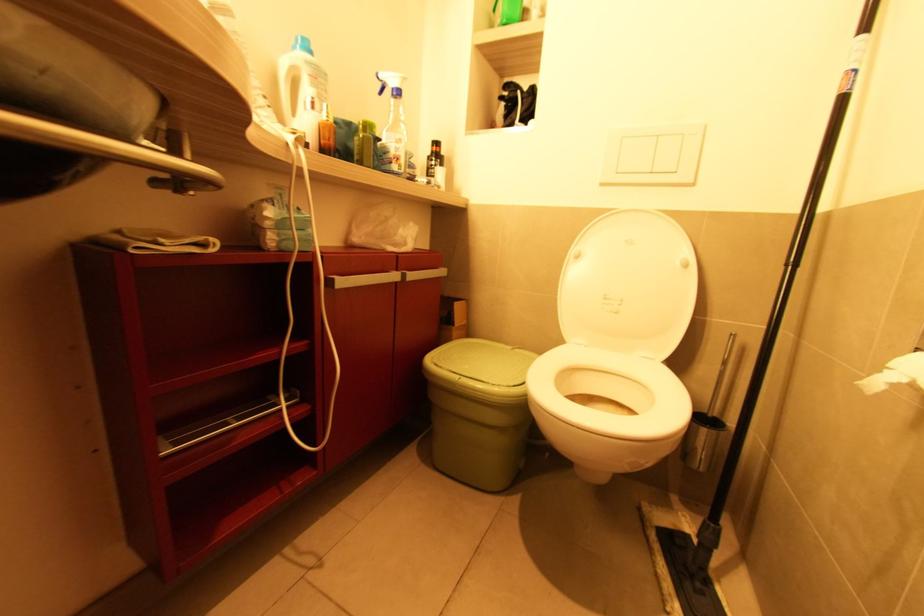
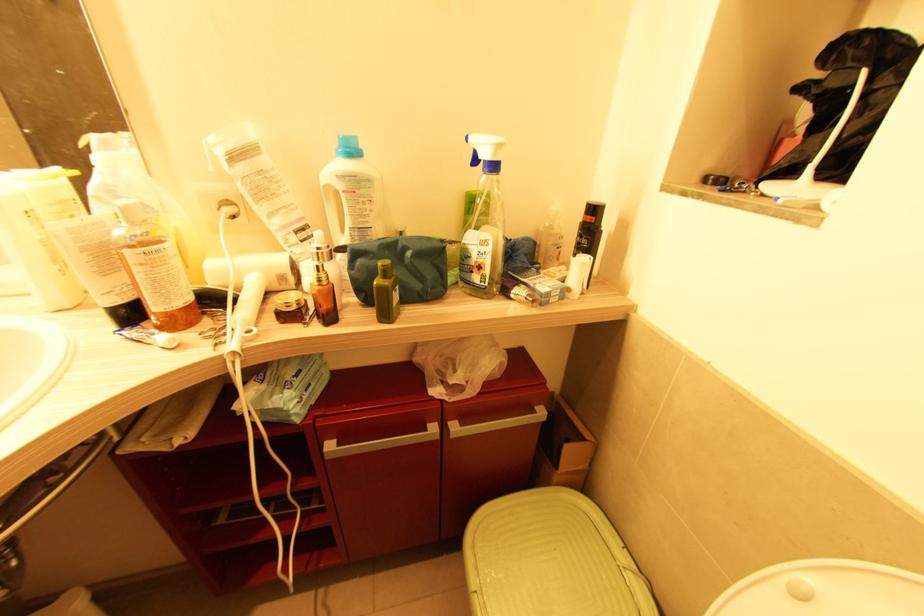
In the second image, find the point that corresponds to (515,349) in the first image.

(626, 570)